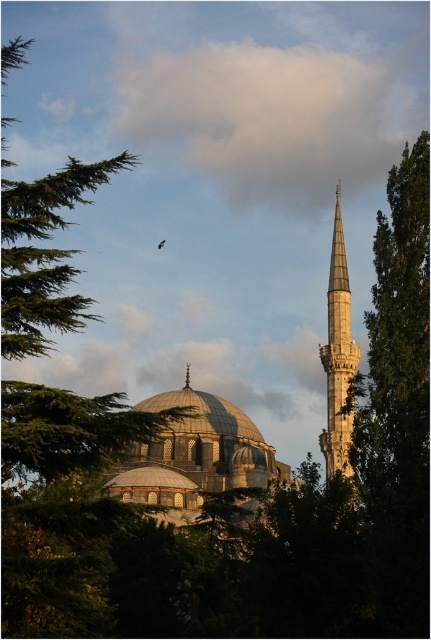
Is point (181, 506) positioned behind point (161, 241)?

No, (181, 506) is closer to viewer.

Can you confirm if gray stone dome at center is positioned below brown feathered bird at upper center?

Yes.

Measure the distance between gray stone dome at center and camera.

A distance of 76.65 meters exists between gray stone dome at center and camera.

Locate an element on the screen. gray stone dome at center is located at coordinates (193, 458).

Is point (165, 480) less distant than point (327, 353)?

Yes, it is in front of point (327, 353).

Is gray stone dome at center to the right of white marble minaret at center from the viewer's perspective?

In fact, gray stone dome at center is to the left of white marble minaret at center.

Does point (165, 477) come farther from viewer compared to point (352, 422)?

Yes.

Find the location of `gray stone dome at center`. gray stone dome at center is located at coordinates (193, 458).

Is white fluffy cloud at upper center bigger than brown feathered bird at upper center?

Yes, white fluffy cloud at upper center is bigger than brown feathered bird at upper center.

Which of these two, white fluffy cloud at upper center or brown feathered bird at upper center, stands taller?

With more height is white fluffy cloud at upper center.

Describe the element at coordinates (274, 116) in the screenshot. I see `white fluffy cloud at upper center` at that location.

The width and height of the screenshot is (431, 640). Find the location of `white fluffy cloud at upper center`. white fluffy cloud at upper center is located at coordinates (274, 116).